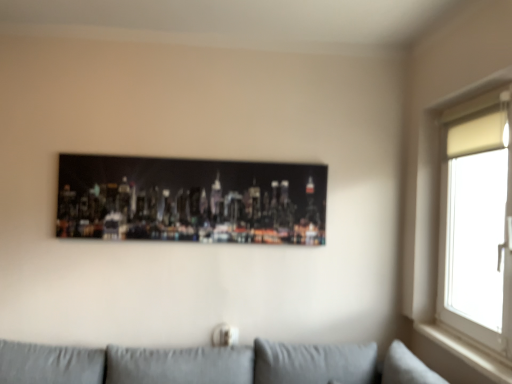
Question: Looking at their shapes, would you say white wood window sill at right is wider or thinner than metallic cityscape print at center?

Choices:
 (A) thin
 (B) wide

Answer: (B)

Question: In the image, is white wood window sill at right positioned in front of or behind metallic cityscape print at center?

Choices:
 (A) behind
 (B) front

Answer: (B)

Question: Which is nearer to the white wood window sill at right?

Choices:
 (A) metallic cityscape print at center
 (B) white matte window at upper right

Answer: (B)

Question: Which object is the closest to the white matte window at upper right?

Choices:
 (A) metallic cityscape print at center
 (B) white wood window sill at right

Answer: (B)